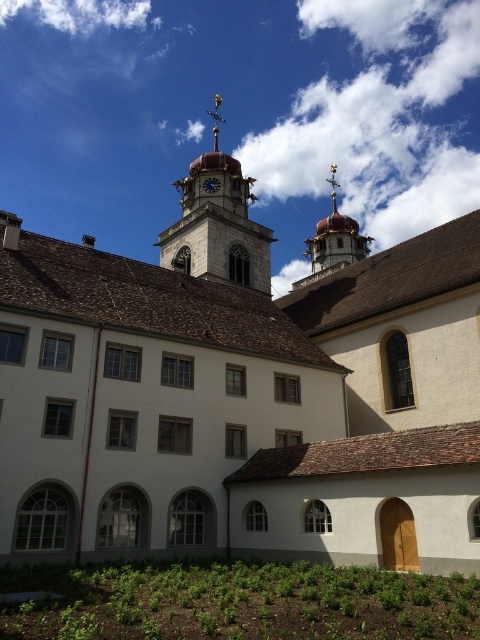
You are standing in the courtyard of the historic building and want to take a photo of the smooth stone clock tower at upper center. To ensure the clock tower is centered in your photo, where should you position yourself relative to the building?

To center the smooth stone clock tower at upper center in your photo, you should position yourself directly in front of the building at the point corresponding to coordinates approximately 0.350 on the horizontal axis and 0.454 on the vertical axis.

You are standing in front of the historic building and want to locate two specific points on its facade. The first point is at coordinates point [333,236] and the second is at point [217,179]. Which of these points is closer to your current position?

Point [333,236] is further to the viewer than point [217,179], so the point closer to your position is point [217,179].

You are standing in front of the historic building and notice two points marked on the facade. The first point is at coordinates point [257,230] and the second is at point [323,252]. Which of these two points is closer to your current position?

Point [257,230] is closer to the camera than point [323,252], so the first point is closer to your current position.